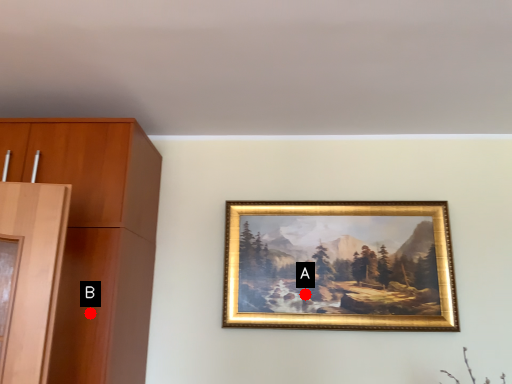
Question: Two points are circled on the image, labeled by A and B beside each circle. Which point is closer to the camera taking this photo?

Choices:
 (A) A is closer
 (B) B is closer

Answer: (B)